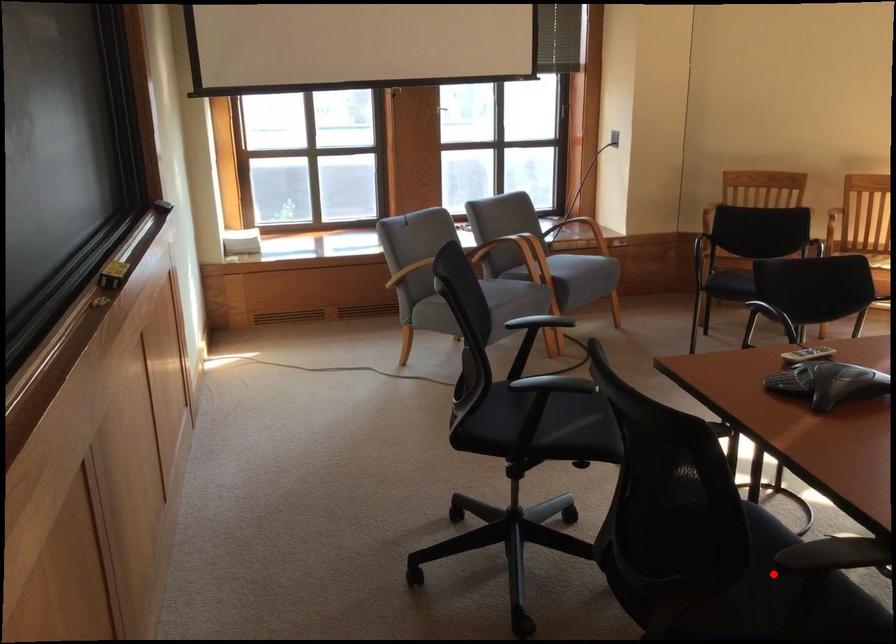
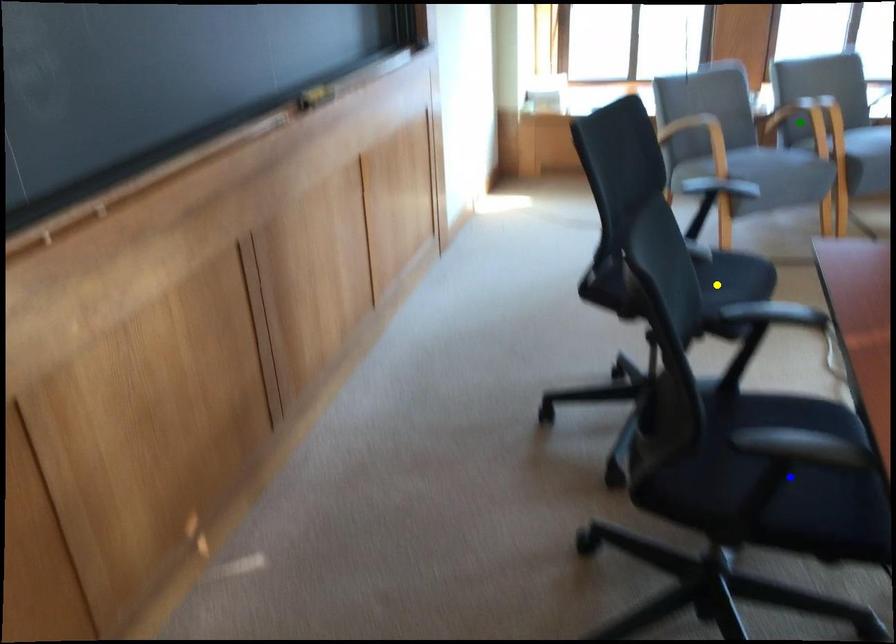
Question: I am providing you with two images of the same scene from different viewpoints. A red point is marked on the first image. You are given multiple points on the second image. In image 2, which mark is for the same physical point as the one in image 1?

Choices:
 (A) yellow point
 (B) green point
 (C) blue point

Answer: (C)